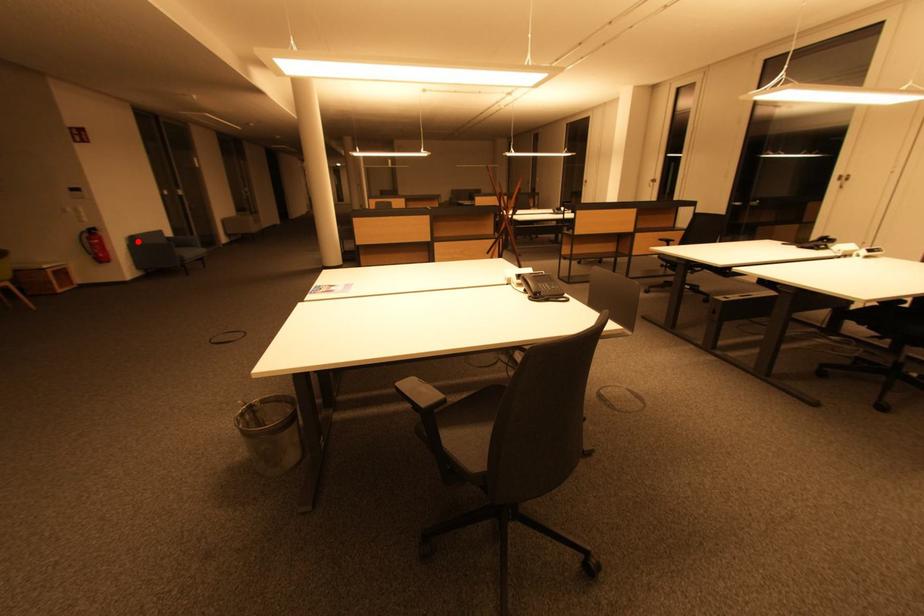
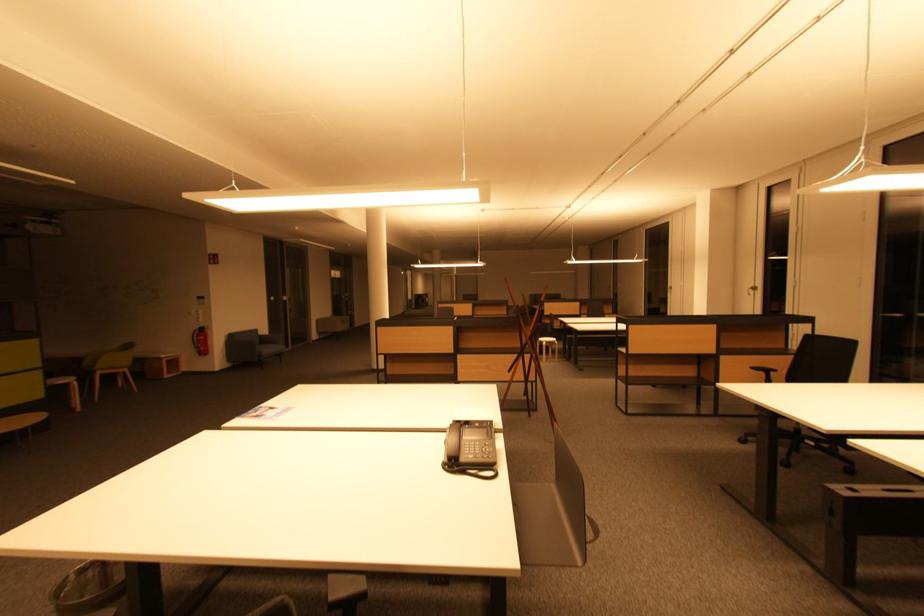
Question: I am providing you with two images of the same scene from different viewpoints. A red point is marked on the first image. Can you still see the location of the red point in image 2?

Choices:
 (A) Yes
 (B) No

Answer: (A)